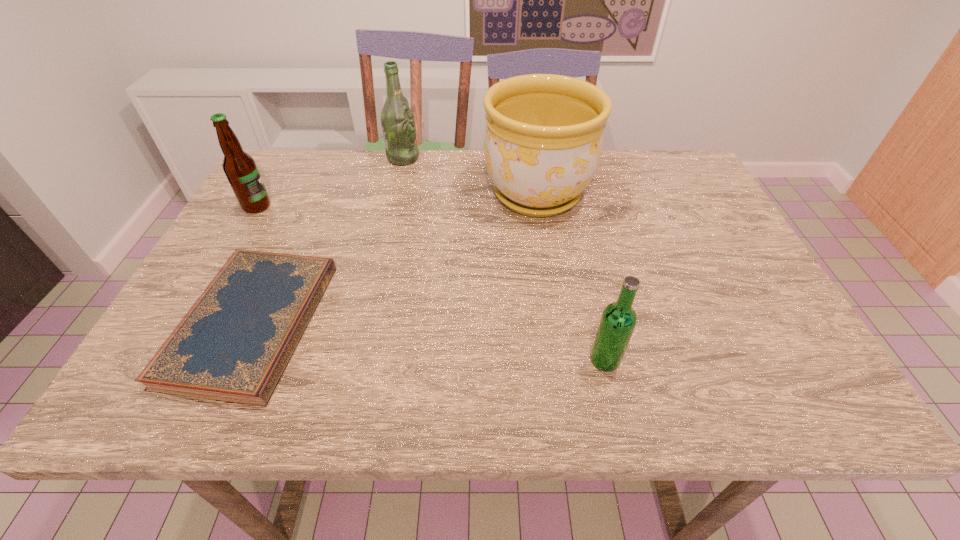
At what (x,y) coordinates should I click in order to perform the action: click on free location that satisfies the following two spatial constraints: 1. on the back side of the shortest object; 2. on the label of the leftmost beer bottle. Please return your answer as a coordinate pair (x, y). The image size is (960, 540). Looking at the image, I should click on (305, 206).